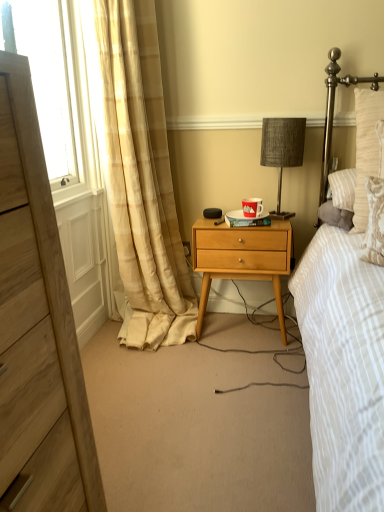
Locate an element on the screen. Image resolution: width=384 pixels, height=512 pixels. transparent glass window screen at left is located at coordinates tap(50, 79).

What do you see at coordinates (50, 79) in the screenshot? Image resolution: width=384 pixels, height=512 pixels. I see `transparent glass window screen at left` at bounding box center [50, 79].

At what (x,y) coordinates should I click in order to perform the action: click on wooden chest of drawers at left. Please return your answer as a coordinate pair (x, y). This screenshot has width=384, height=512. Looking at the image, I should click on (37, 326).

At what (x,y) coordinates should I click in order to perform the action: click on transparent glass window screen at left. Please return your answer as a coordinate pair (x, y). Looking at the image, I should click on (50, 79).

Considering the positions of points (127, 39) and (54, 464), is point (127, 39) farther from camera compared to point (54, 464)?

That is True.

Considering the relative sizes of beige plaid curtain at left and wooden chest of drawers at left in the image provided, is beige plaid curtain at left wider than wooden chest of drawers at left?

Indeed, beige plaid curtain at left has a greater width compared to wooden chest of drawers at left.

What's the angular difference between beige plaid curtain at left and wooden chest of drawers at left's facing directions?

The angular difference between beige plaid curtain at left and wooden chest of drawers at left is 1.31 degrees.

Looking at this image, considering the positions of objects beige plaid curtain at left and wooden chest of drawers at left in the image provided, who is in front, beige plaid curtain at left or wooden chest of drawers at left?

wooden chest of drawers at left is closer to the camera.

Is woven fabric headboard at upper right at the right side of beige plaid curtain at left?

Correct, you'll find woven fabric headboard at upper right to the right of beige plaid curtain at left.

Find the location of a particular element. curtain located below the woven fabric headboard at upper right (from the image's perspective) is located at coordinates (139, 175).

From the image's perspective, does woven fabric headboard at upper right appear lower than beige plaid curtain at left?

No, from the image's perspective, woven fabric headboard at upper right is not below beige plaid curtain at left.

Based on the photo, could you tell me if woven fabric headboard at upper right is turned towards beige plaid curtain at left?

No, woven fabric headboard at upper right is not oriented towards beige plaid curtain at left.

From the image's perspective, relative to textured gray lampshade at center, is wooden chest of drawers at left above or below?

Based on their image positions, wooden chest of drawers at left is located beneath textured gray lampshade at center.

From a real-world perspective, is wooden chest of drawers at left on top of textured gray lampshade at center?

No.

Is wooden chest of drawers at left situated inside textured gray lampshade at center or outside?

wooden chest of drawers at left lies outside textured gray lampshade at center.

Can you confirm if wooden chest of drawers at left is positioned to the left of textured gray lampshade at center?

Indeed, wooden chest of drawers at left is positioned on the left side of textured gray lampshade at center.

How much distance is there between transparent glass window screen at left and textured gray lampshade at center?

1.02 meters.

Is transparent glass window screen at left outside of textured gray lampshade at center?

Yes, transparent glass window screen at left is not within textured gray lampshade at center.

Considering the sizes of transparent glass window screen at left and textured gray lampshade at center in the image, is transparent glass window screen at left taller or shorter than textured gray lampshade at center?

Considering their sizes, transparent glass window screen at left has more height than textured gray lampshade at center.

Considering the relative positions of transparent glass window screen at left and textured gray lampshade at center in the image provided, is transparent glass window screen at left in front of textured gray lampshade at center?

Yes, it is.

The width and height of the screenshot is (384, 512). I want to click on window screen on the left of the wooden nightstand at center, so click(x=50, y=79).

Is transparent glass window screen at left facing away from wooden nightstand at center?

That's not correct — transparent glass window screen at left is not looking away from wooden nightstand at center.

From a real-world perspective, is transparent glass window screen at left located beneath wooden nightstand at center?

No, from a real-world perspective, transparent glass window screen at left is not under wooden nightstand at center.

Which point is more forward, (x=67, y=50) or (x=290, y=233)?

The point (x=67, y=50) is in front.

Between wooden nightstand at center and beige plaid curtain at left, which one has less height?

wooden nightstand at center.

From the image's perspective, is wooden nightstand at center located above or below beige plaid curtain at left?

Clearly, from the image's perspective, wooden nightstand at center is below beige plaid curtain at left.

Is wooden nightstand at center next to beige plaid curtain at left?

No.

Consider the image. From the image's perspective, is transparent glass window screen at left on woven fabric headboard at upper right?

Yes, from the image's perspective, transparent glass window screen at left is on top of woven fabric headboard at upper right.

The width and height of the screenshot is (384, 512). What are the coordinates of `headboard below the transparent glass window screen at left (from a real-world perspective)` in the screenshot? It's located at (333, 110).

Is transparent glass window screen at left bigger than woven fabric headboard at upper right?

Yes, transparent glass window screen at left is bigger than woven fabric headboard at upper right.

At what (x,y) coordinates should I click in order to perform the action: click on curtain located on the right of wooden chest of drawers at left. Please return your answer as a coordinate pair (x, y). This screenshot has height=512, width=384. Looking at the image, I should click on (139, 175).

The height and width of the screenshot is (512, 384). In order to click on headboard located above the beige plaid curtain at left (from a real-world perspective) in this screenshot , I will do `click(333, 110)`.

Estimate the real-world distances between objects in this image. Which object is closer to transparent glass window screen at left, textured gray lampshade at center or wooden nightstand at center?

The object closer to transparent glass window screen at left is wooden nightstand at center.

When comparing their distances from textured gray lampshade at center, does transparent glass window screen at left or woven fabric headboard at upper right seem closer?

woven fabric headboard at upper right is closer to textured gray lampshade at center.

Looking at the image, which one is located further to wooden chest of drawers at left, wooden nightstand at center or transparent glass window screen at left?

Based on the image, transparent glass window screen at left appears to be further to wooden chest of drawers at left.

Based on their spatial positions, is woven fabric headboard at upper right or wooden nightstand at center closer to wooden chest of drawers at left?

Based on the image, wooden nightstand at center appears to be nearer to wooden chest of drawers at left.

Which object lies further to the anchor point wooden chest of drawers at left, woven fabric headboard at upper right or textured gray lampshade at center?

woven fabric headboard at upper right lies further to wooden chest of drawers at left than the other object.

Based on their spatial positions, is woven fabric headboard at upper right or wooden nightstand at center closer to transparent glass window screen at left?

wooden nightstand at center is positioned closer to the anchor transparent glass window screen at left.

From the image, which object appears to be nearer to wooden chest of drawers at left, wooden nightstand at center or beige plaid curtain at left?

The object closer to wooden chest of drawers at left is wooden nightstand at center.

Which object lies nearer to the anchor point beige plaid curtain at left, woven fabric headboard at upper right or wooden chest of drawers at left?

woven fabric headboard at upper right lies closer to beige plaid curtain at left than the other object.

The image size is (384, 512). Identify the location of nightstand between beige plaid curtain at left and woven fabric headboard at upper right from left to right. (242, 258).

At what (x,y) coordinates should I click in order to perform the action: click on chest of drawers between transparent glass window screen at left and beige plaid curtain at left. Please return your answer as a coordinate pair (x, y). Looking at the image, I should click on (37, 326).

I want to click on curtain between transparent glass window screen at left and textured gray lampshade at center, so click(x=139, y=175).

The width and height of the screenshot is (384, 512). Find the location of `bedside lamp between transparent glass window screen at left and woven fabric headboard at upper right in the horizontal direction`. bedside lamp between transparent glass window screen at left and woven fabric headboard at upper right in the horizontal direction is located at coordinates (282, 150).